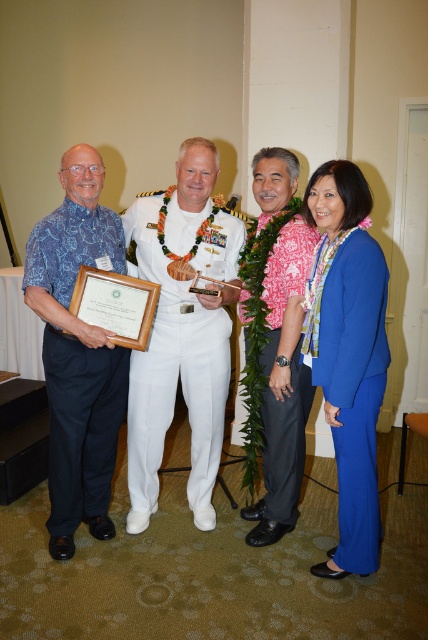
Question: Observing the image, what is the correct spatial positioning of blue printed shirt at left in reference to matte blue suit at center?

Choices:
 (A) above
 (B) below

Answer: (A)

Question: Which point is farther to the camera?

Choices:
 (A) pink floral shirt at center
 (B) blue printed shirt at left

Answer: (A)

Question: Among these points, which one is nearest to the camera?

Choices:
 (A) (281, 278)
 (B) (160, 340)
 (C) (77, 444)
 (D) (365, 557)

Answer: (D)

Question: Does white uniform at center have a smaller size compared to matte blue suit at center?

Choices:
 (A) yes
 (B) no

Answer: (B)

Question: Is blue printed shirt at left below pink floral shirt at center?

Choices:
 (A) yes
 (B) no

Answer: (A)

Question: Which is nearer to the pink floral shirt at center?

Choices:
 (A) blue printed shirt at left
 (B) matte blue suit at center

Answer: (B)